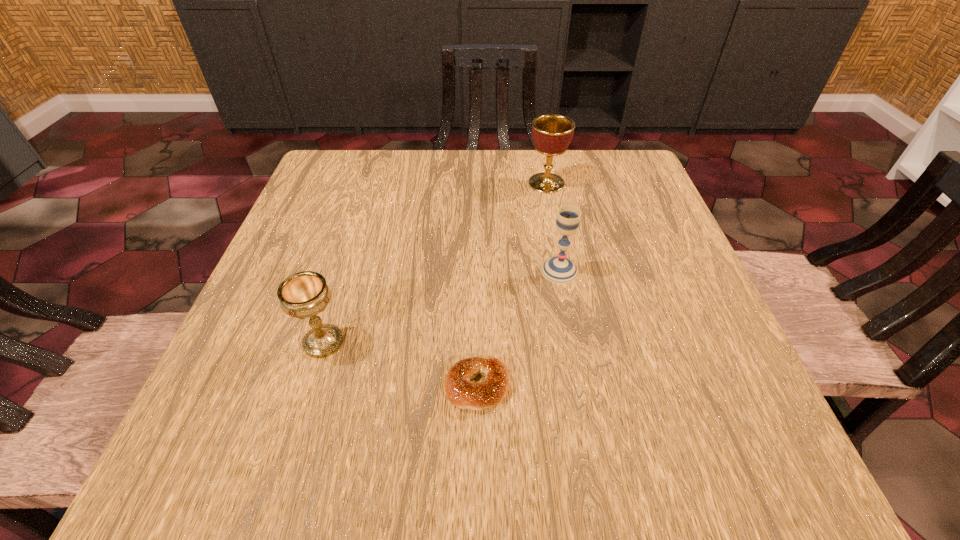
This screenshot has height=540, width=960. Identify the location of free spot between the third object from right to left and the nearest chalice. (400, 364).

The image size is (960, 540). I want to click on free spot between the second farthest object and the third object from right to left, so click(x=518, y=328).

You are a GUI agent. You are given a task and a screenshot of the screen. Output one action in this format:
    pyautogui.click(x=<x>, y=<y>)
    Task: Click on the free space that is in between the second farthest object and the farthest object
    This screenshot has width=960, height=540.
    Given the screenshot: What is the action you would take?
    pyautogui.click(x=553, y=227)

Locate an element on the screen. Image resolution: width=960 pixels, height=540 pixels. blank region between the shortest object and the second farthest chalice is located at coordinates (518, 328).

The image size is (960, 540). I want to click on unoccupied position between the nearest chalice and the second farthest object, so 442,306.

Locate an element on the screen. vacant point located between the farthest chalice and the third nearest object is located at coordinates (553, 227).

At what (x,y) coordinates should I click in order to perform the action: click on free space between the third nearest object and the third object from right to left. Please return your answer as a coordinate pair (x, y). The image size is (960, 540). Looking at the image, I should click on (518, 328).

Where is `unoccupied position between the farthest object and the second nearest chalice`? Image resolution: width=960 pixels, height=540 pixels. unoccupied position between the farthest object and the second nearest chalice is located at coordinates (553, 227).

This screenshot has height=540, width=960. Identify the location of blank region between the nearest object and the farthest object. (512, 285).

Locate an element on the screen. This screenshot has height=540, width=960. vacant point located between the leftmost chalice and the second farthest chalice is located at coordinates (442, 306).